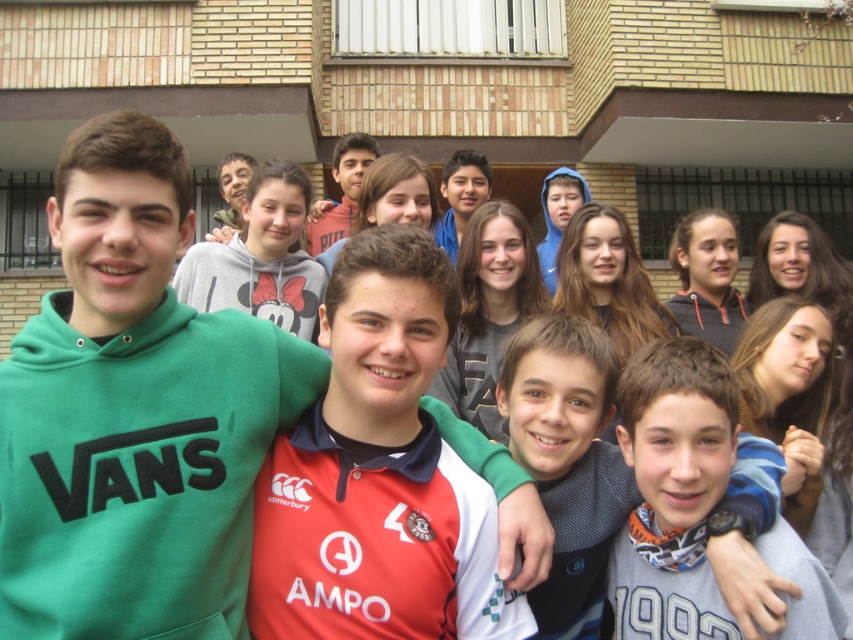
Is gray knit sweater at center behind smooth brown hair at center?

No, it is in front of smooth brown hair at center.

Is point (585, 412) farther from viewer compared to point (618, 339)?

No.

The image size is (853, 640). I want to click on gray knit sweater at center, so click(x=567, y=460).

Is red jersey at center closer to camera compared to gray hoodie at center?

That is True.

Is point (386, 552) closer to viewer compared to point (722, 298)?

Yes, point (386, 552) is closer to viewer.

Measure the distance between point (355,282) and camera.

The distance of point (355,282) from camera is 10.45 meters.

Locate an element on the screen. This screenshot has height=640, width=853. red jersey at center is located at coordinates (378, 474).

Does point (659, 310) lie in front of point (445, 177)?

Yes, point (659, 310) is in front of point (445, 177).

Is smooth brown hair at center in front of matte blue hoodie at center?

Yes, it is in front of matte blue hoodie at center.

Who is more forward, (x=612, y=234) or (x=474, y=172)?

Positioned in front is point (x=612, y=234).

This screenshot has width=853, height=640. I want to click on smooth brown hair at center, so click(608, 280).